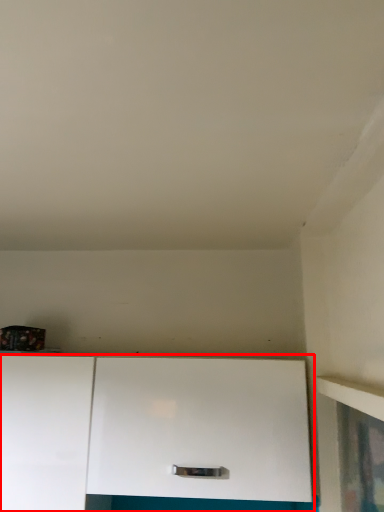
Question: From the image's perspective, considering the relative positions of cabinetry (annotated by the red box) and cabinetry in the image provided, where is cabinetry (annotated by the red box) located with respect to the staircase?

Choices:
 (A) below
 (B) above

Answer: (B)